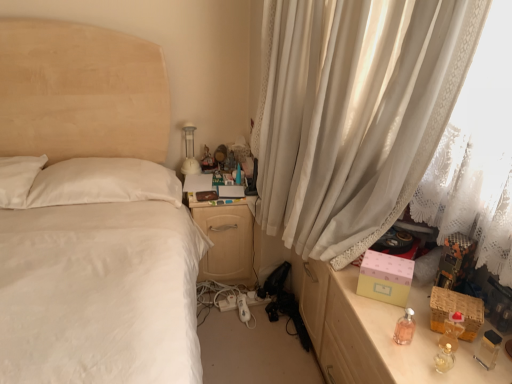
Where is `free space in front of translucent amber bottle at right, which is the first perfume from right to left`? The width and height of the screenshot is (512, 384). free space in front of translucent amber bottle at right, which is the first perfume from right to left is located at coordinates (445, 365).